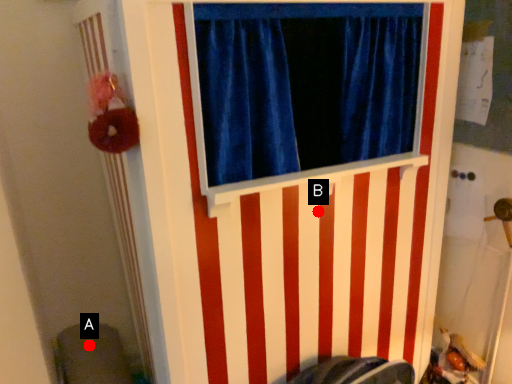
Question: Two points are circled on the image, labeled by A and B beside each circle. Which point is farther to the camera?

Choices:
 (A) A is further
 (B) B is further

Answer: (A)